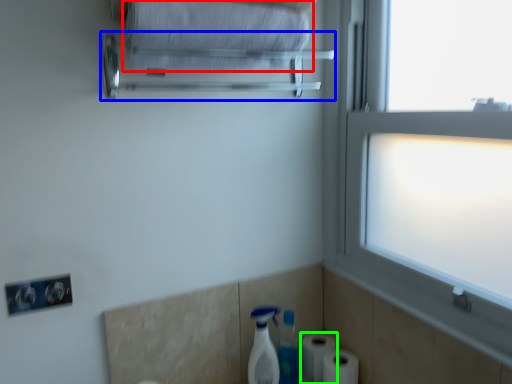
Question: Based on their relative distances, which object is nearer to bath towel (highlighted by a red box)? Choose from towel bar (highlighted by a blue box) and toilet paper (highlighted by a green box).

Choices:
 (A) towel bar
 (B) toilet paper

Answer: (A)